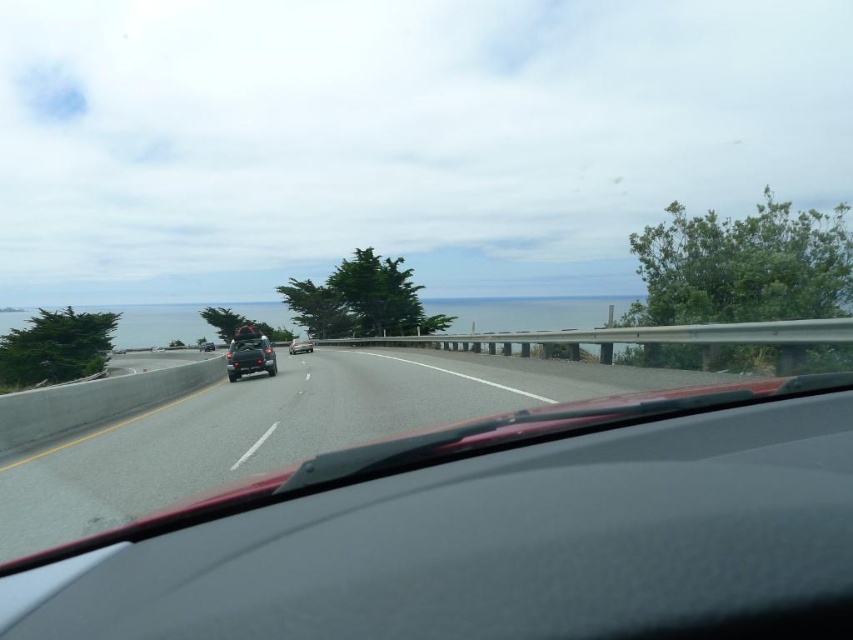
Can you confirm if asphalt road at center is thinner than satin black suv at center?

In fact, asphalt road at center might be wider than satin black suv at center.

Which is in front, point (691, 332) or point (270, 362)?

Point (691, 332)

Image resolution: width=853 pixels, height=640 pixels. In order to click on asphalt road at center in this screenshot , I will do `click(282, 429)`.

Which is above, asphalt road at center or satin black car at center?

satin black car at center

Who is more forward, (492, 360) or (294, 344)?

Point (492, 360) is more forward.

This screenshot has width=853, height=640. What are the coordinates of `asphalt road at center` in the screenshot? It's located at (282, 429).

Is satin black suv at center above satin black car at center?

Correct, satin black suv at center is located above satin black car at center.

Does satin black suv at center come in front of satin black car at center?

Yes, it is in front of satin black car at center.

Image resolution: width=853 pixels, height=640 pixels. I want to click on satin black suv at center, so click(248, 355).